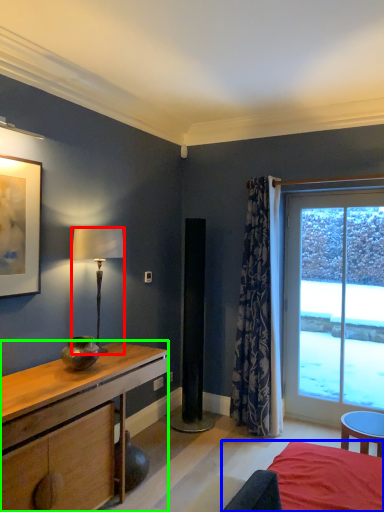
Question: Which object is positioned closest to lamp (highlighted by a red box)? Select from bed (highlighted by a blue box) and desk (highlighted by a green box).

Choices:
 (A) bed
 (B) desk

Answer: (B)